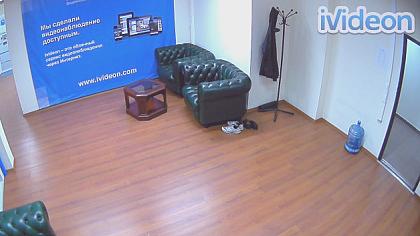
This screenshot has height=236, width=420. What are the coordinates of `green armchair` in the screenshot? It's located at (177, 59), (206, 83), (30, 221).